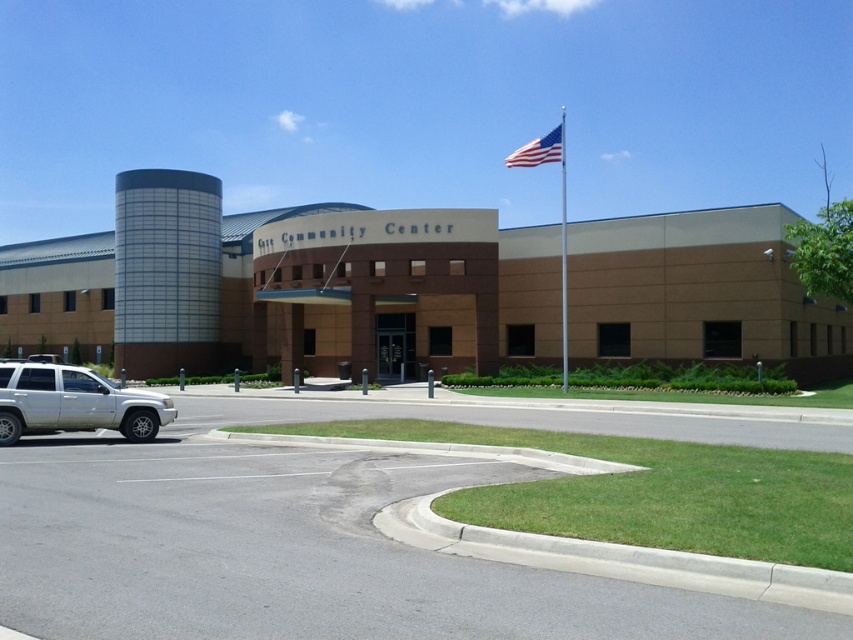
Does silver metallic suv at lower left have a lesser height compared to american flag at upper right?

Correct, silver metallic suv at lower left is not as tall as american flag at upper right.

Between point (73, 371) and point (547, 147), which one is positioned behind?

Point (547, 147)

In order to click on silver metallic suv at lower left in this screenshot , I will do pyautogui.click(x=74, y=403).

Does silver metallic suv at lower left have a greater width compared to metallic silver flag pole at upper right?

No.

Is point (146, 416) less distant than point (566, 369)?

Yes, it is.

The width and height of the screenshot is (853, 640). I want to click on silver metallic suv at lower left, so click(74, 403).

Does metallic silver flag pole at upper right have a smaller size compared to american flag at upper right?

No.

In the scene shown: Between metallic silver flag pole at upper right and american flag at upper right, which one appears on the left side from the viewer's perspective?

From the viewer's perspective, american flag at upper right appears more on the left side.

Which is behind, point (563, 204) or point (550, 148)?

The point (563, 204) is behind.

Identify the location of metallic silver flag pole at upper right. (563, 253).